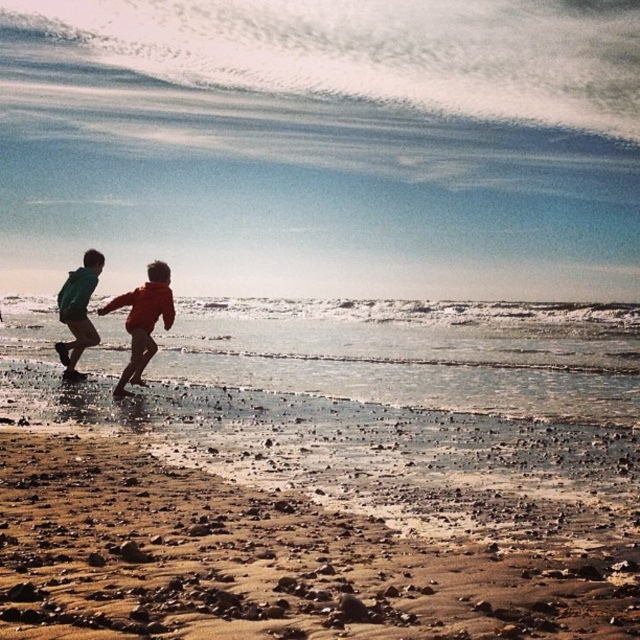
You are a photographer trying to capture the orange fabric child at center and the brown sandy beach at lower left in the same frame. Based on their positions, can you tell which object is closer to the camera?

The brown sandy beach at lower left is positioned under the orange fabric child at center, meaning the orange fabric child at center is closer to the camera than the brown sandy beach at lower left.

You are standing on the beach and see two points marked on the sand. The first point is at coordinates point (x=164, y=268) and the second point is at point (x=58, y=316). Which point is closer to you?

Point (x=164, y=268) is in front of point (x=58, y=316), so it is closer to you.